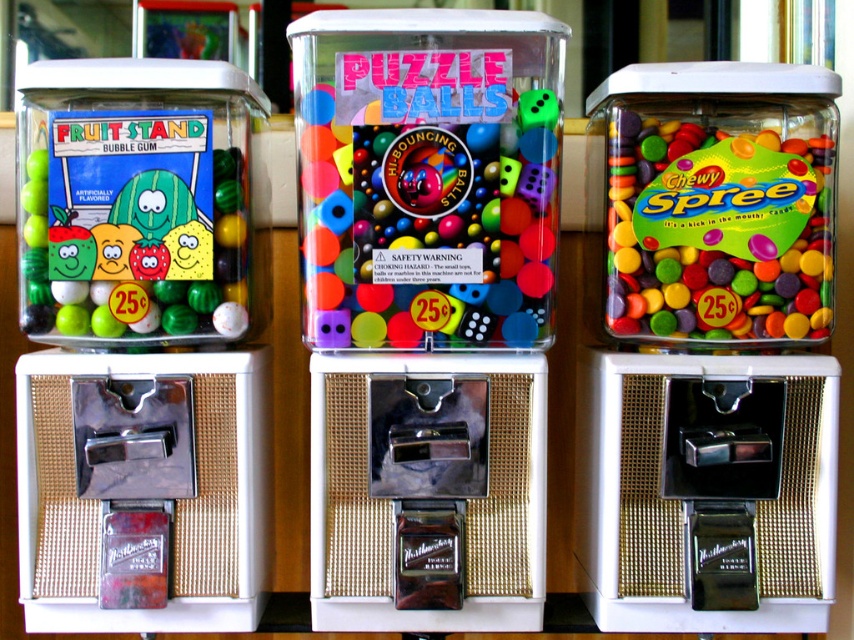
Question: Does matte plastic jar at left appear on the left side of multicolored plastic puzzle balls at center?

Choices:
 (A) yes
 (B) no

Answer: (A)

Question: Can you confirm if multicolored plastic puzzle balls at center is positioned to the left of matte plastic chewy spree at right?

Choices:
 (A) yes
 (B) no

Answer: (A)

Question: Based on their relative distances, which object is farther from the matte plastic jar at left?

Choices:
 (A) multicolored plastic puzzle balls at center
 (B) matte plastic chewy spree at right

Answer: (B)

Question: Which object is positioned closest to the matte plastic chewy spree at right?

Choices:
 (A) matte plastic jar at left
 (B) multicolored plastic puzzle balls at center

Answer: (B)

Question: In this image, where is matte plastic jar at left located relative to multicolored plastic puzzle balls at center?

Choices:
 (A) right
 (B) left

Answer: (B)

Question: Which point appears farthest from the camera in this image?

Choices:
 (A) pyautogui.click(x=524, y=163)
 (B) pyautogui.click(x=630, y=177)
 (C) pyautogui.click(x=34, y=68)

Answer: (B)